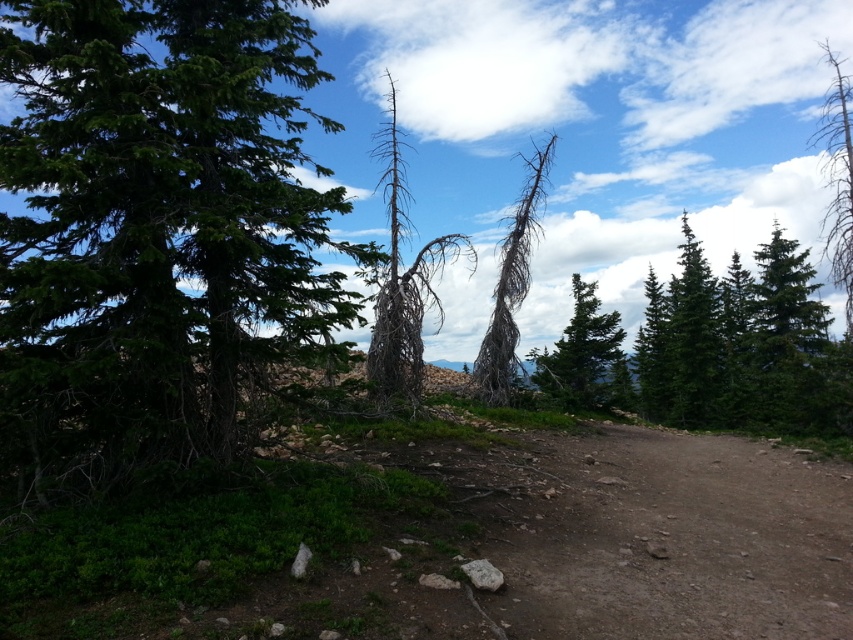
Question: Which point is farther from the camera taking this photo?

Choices:
 (A) (529, 195)
 (B) (260, 104)

Answer: (A)

Question: Does green matte tree at upper right have a larger size compared to green textured tree at upper center?

Choices:
 (A) yes
 (B) no

Answer: (A)

Question: Is gray-brown deadwood at center further to camera compared to green textured tree at upper center?

Choices:
 (A) yes
 (B) no

Answer: (B)

Question: Based on their relative distances, which object is farther from the green matte tree at left?

Choices:
 (A) green matte tree at upper right
 (B) bare wood tree at upper right
 (C) gray-brown deadwood at center
 (D) gray bark tree at center

Answer: (B)

Question: Which point is farther to the camera?

Choices:
 (A) (837, 115)
 (B) (572, 282)
 (C) (514, 212)
 (D) (395, 212)

Answer: (C)

Question: Is gray bark tree at center below green textured tree at upper center?

Choices:
 (A) yes
 (B) no

Answer: (B)